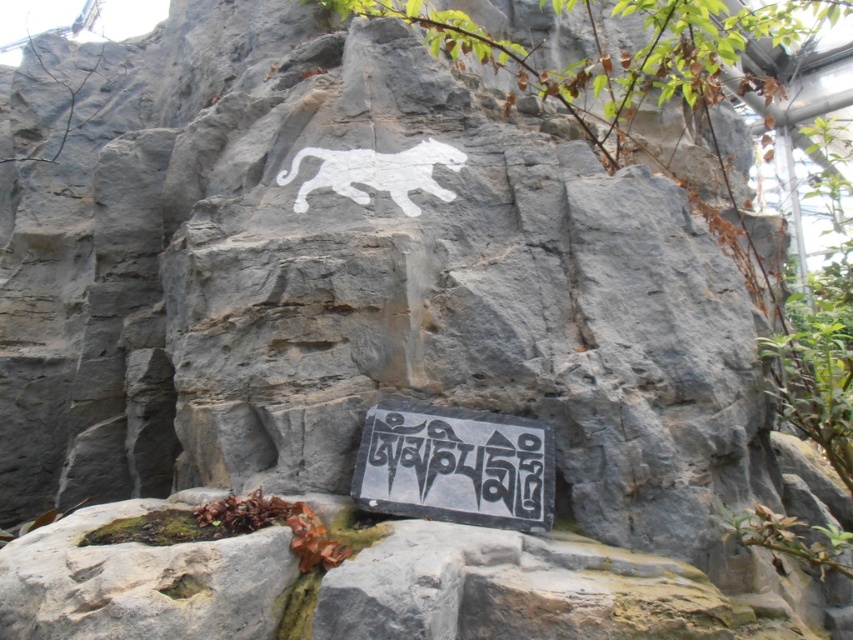
You are standing at the point with coordinates point [451,156] and want to walk to the point with coordinates point [422,456]. Which direction should you move in to reach your destination?

You should move forward because point [422,456] is in front of point [451,156].

You are a zookeeper checking the enclosure. You need to place a new feeding tray between the black stone sign at lower center and the white painted tiger at center. Which object should you position the feeding tray closer to so it doesn

The black stone sign at lower center is taller than the white painted tiger at center, so positioning the feeding tray closer to the black stone sign at lower center would provide better visibility and accessibility for the animals.